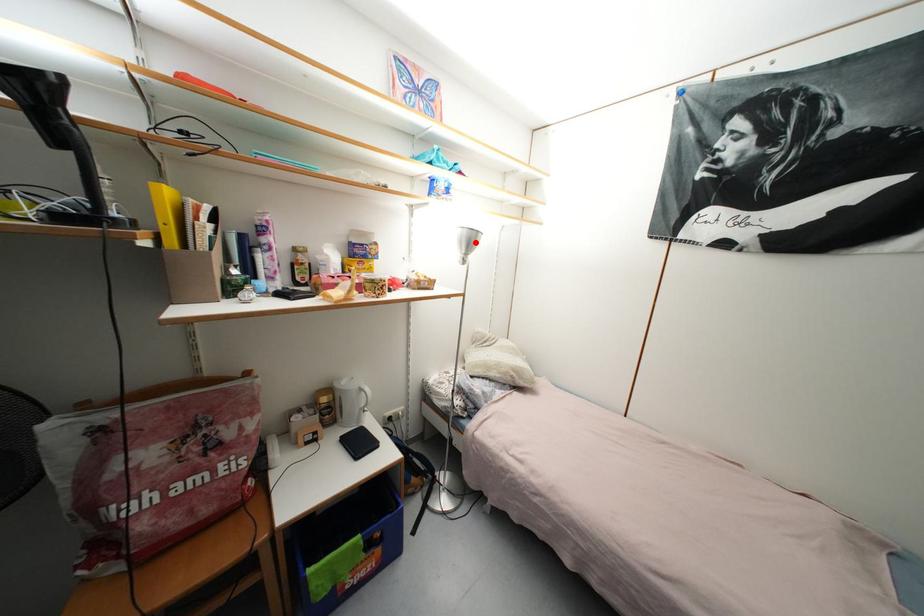
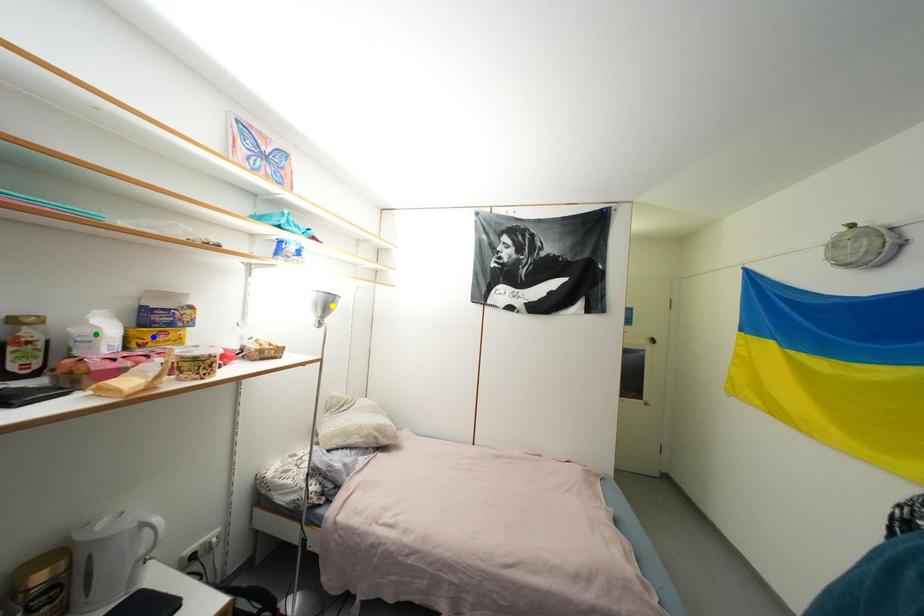
Question: I am providing you with two images of the same scene from different viewpoints. A red point is marked on the first image. You are given multiple points on the second image. Which point in image 2 represents the same 3d spot as the red point in image 1?

Choices:
 (A) yellow point
 (B) green point
 (C) blue point

Answer: (A)